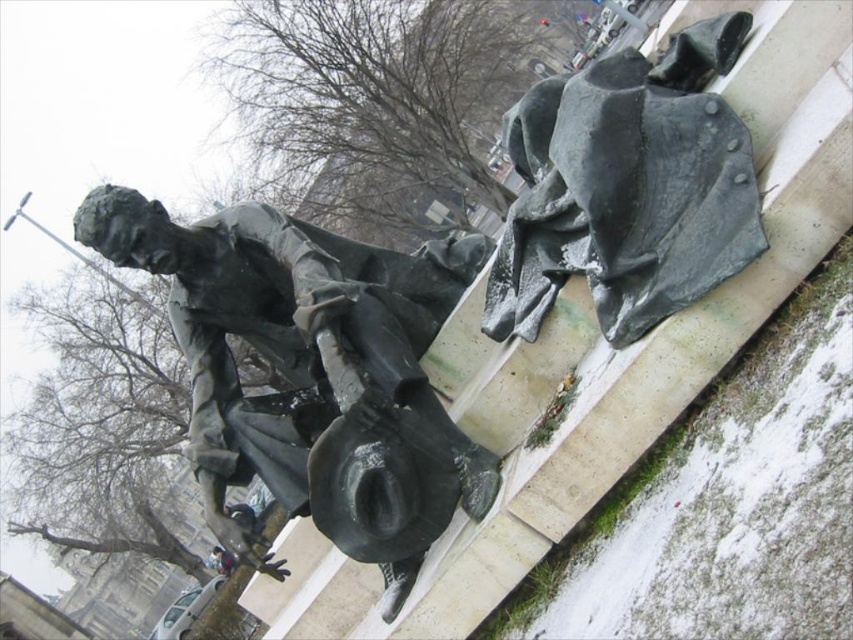
Can you confirm if bronze statue at center is thinner than rusty metal cape at upper right?

In fact, bronze statue at center might be wider than rusty metal cape at upper right.

Does point (96, 221) come behind point (668, 54)?

Yes, point (96, 221) is farther from viewer.

Which is behind, point (421, 300) or point (518, 257)?

The point (421, 300) is more distant.

Image resolution: width=853 pixels, height=640 pixels. Identify the location of bronze statue at center. (296, 342).